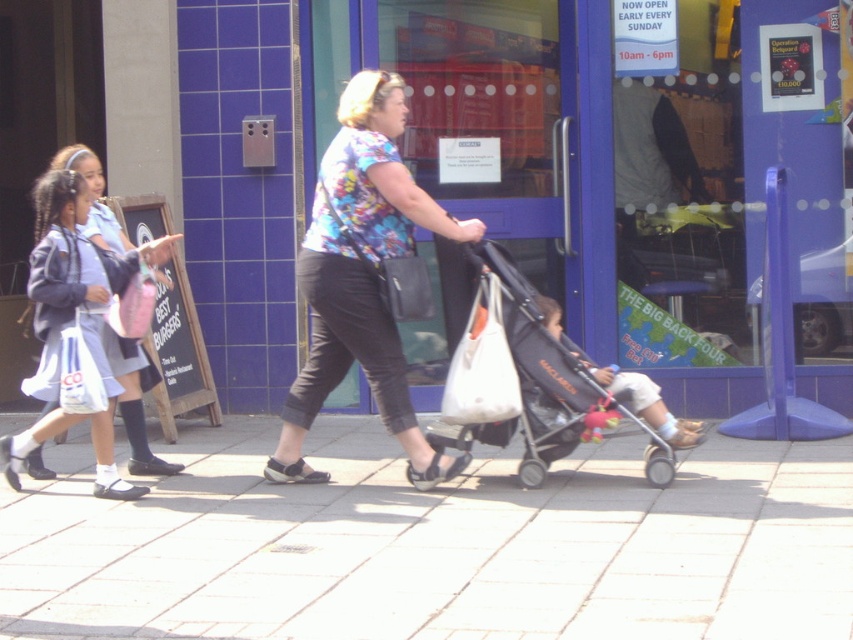
Question: Where is light blue uniform at left located in relation to light beige fabric stroller at center in the image?

Choices:
 (A) above
 (B) below

Answer: (A)

Question: Can you confirm if blue glass door at center is bigger than white fabric bag at center?

Choices:
 (A) yes
 (B) no

Answer: (B)

Question: In this image, where is floral fabric shirt at center located relative to light beige fabric stroller at center?

Choices:
 (A) right
 (B) left

Answer: (B)

Question: Which point appears farthest from the camera in this image?

Choices:
 (A) (18, 611)
 (B) (636, 404)
 (C) (55, 410)

Answer: (C)

Question: Which of the following is the closest to the observer?

Choices:
 (A) blue glass door at center
 (B) light beige fabric stroller at center
 (C) black fabric stroller at center

Answer: (C)

Question: Which object is closer to the camera taking this photo?

Choices:
 (A) light blue uniform at left
 (B) white fabric bag at center
 (C) blue glass door at center

Answer: (A)